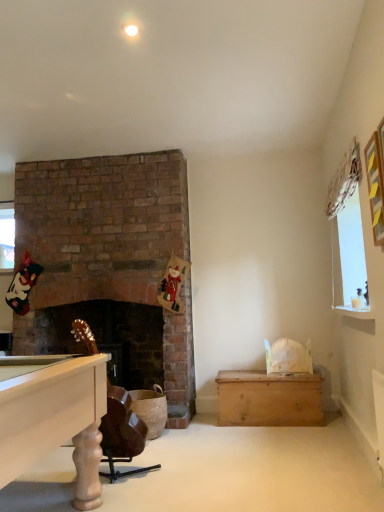
What are the coordinates of `wooden chest at lower right` in the screenshot? It's located at 268,398.

Measure the distance between point (122, 472) and camera.

The distance of point (122, 472) from camera is 2.57 meters.

Image resolution: width=384 pixels, height=512 pixels. I want to click on wooden chest at lower right, so click(268, 398).

Would you say brown leather rocking chair at lower left is a long distance from wooden chest at lower right?

Yes, brown leather rocking chair at lower left and wooden chest at lower right are quite far apart.

Does brown leather rocking chair at lower left appear on the left side of wooden chest at lower right?

Yes, brown leather rocking chair at lower left is to the left of wooden chest at lower right.

You are a GUI agent. You are given a task and a screenshot of the screen. Output one action in this format:
    pyautogui.click(x=<x>, y=<y>)
    Task: Click on the rocking chair lying on the left of wooden chest at lower right
    Image resolution: width=384 pixels, height=512 pixels.
    Given the screenshot: What is the action you would take?
    pyautogui.click(x=122, y=433)

From a real-world perspective, is wooden chest at lower right on top of yellow paper picture frame at upper right?

No.

Are wooden chest at lower right and yellow paper picture frame at upper right making contact?

wooden chest at lower right and yellow paper picture frame at upper right are clearly separated.

From the image's perspective, is wooden chest at lower right under yellow paper picture frame at upper right?

Yes, from the image's perspective, wooden chest at lower right is beneath yellow paper picture frame at upper right.

Is brown leather rocking chair at lower left not near yellow paper picture frame at upper right?

brown leather rocking chair at lower left is far away from yellow paper picture frame at upper right.

Which is in front, point (128, 461) or point (378, 138)?

The point (378, 138) is in front.

Does brown leather rocking chair at lower left come behind yellow paper picture frame at upper right?

Yes, it is behind yellow paper picture frame at upper right.

The width and height of the screenshot is (384, 512). Identify the location of picture frame above the brown leather rocking chair at lower left (from a real-world perspective). (375, 188).

Between yellow paper picture frame at upper right and wooden chest at lower right, which one appears on the left side from the viewer's perspective?

wooden chest at lower right is more to the left.

Which of these two, yellow paper picture frame at upper right or wooden chest at lower right, is wider?

wooden chest at lower right.

Does yellow paper picture frame at upper right have a lesser height compared to wooden chest at lower right?

No.

Between yellow paper picture frame at upper right and wooden chest at lower right, which one has smaller size?

yellow paper picture frame at upper right.

Locate an element on the screen. This screenshot has height=512, width=384. rocking chair on the left of wooden chest at lower right is located at coordinates (122, 433).

Considering the relative sizes of wooden chest at lower right and brown leather rocking chair at lower left in the image provided, is wooden chest at lower right shorter than brown leather rocking chair at lower left?

Correct, wooden chest at lower right is not as tall as brown leather rocking chair at lower left.

Is wooden chest at lower right turned away from brown leather rocking chair at lower left?

No, wooden chest at lower right is not facing away from brown leather rocking chair at lower left.

Is yellow paper picture frame at upper right facing away from brown leather rocking chair at lower left?

yellow paper picture frame at upper right is not turned away from brown leather rocking chair at lower left.

Who is more distant, yellow paper picture frame at upper right or brown leather rocking chair at lower left?

Positioned behind is brown leather rocking chair at lower left.

Is yellow paper picture frame at upper right not inside brown leather rocking chair at lower left?

Absolutely, yellow paper picture frame at upper right is external to brown leather rocking chair at lower left.

Locate an element on the screen. The height and width of the screenshot is (512, 384). rocking chair above the wooden chest at lower right (from a real-world perspective) is located at coordinates (122, 433).

I want to click on table on the left of the yellow paper picture frame at upper right, so click(x=268, y=398).

Looking at the image, which one is located closer to wooden chest at lower right, yellow paper picture frame at upper right or brown leather rocking chair at lower left?

brown leather rocking chair at lower left.

Based on their spatial positions, is wooden chest at lower right or yellow paper picture frame at upper right further from brown leather rocking chair at lower left?

Among the two, yellow paper picture frame at upper right is located further to brown leather rocking chair at lower left.

Considering their positions, is wooden chest at lower right positioned further to yellow paper picture frame at upper right than brown leather rocking chair at lower left?

Among the two, wooden chest at lower right is located further to yellow paper picture frame at upper right.

From the image, which object appears to be nearer to yellow paper picture frame at upper right, brown leather rocking chair at lower left or wooden chest at lower right?

brown leather rocking chair at lower left.

Looking at the image, which one is located closer to brown leather rocking chair at lower left, yellow paper picture frame at upper right or wooden chest at lower right?

Based on the image, wooden chest at lower right appears to be nearer to brown leather rocking chair at lower left.

Which object lies nearer to the anchor point wooden chest at lower right, brown leather rocking chair at lower left or yellow paper picture frame at upper right?

brown leather rocking chair at lower left is positioned closer to the anchor wooden chest at lower right.

Find the location of a particular element. This screenshot has height=512, width=384. rocking chair between yellow paper picture frame at upper right and wooden chest at lower right from top to bottom is located at coordinates (122, 433).